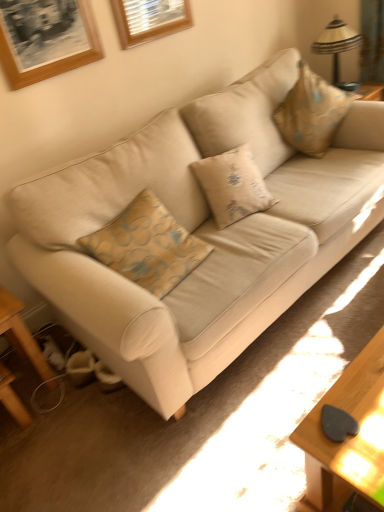
Identify the location of wooden picture frame at upper left, which ranks as the second picture frame in back-to-front order. The image size is (384, 512). (45, 38).

Where is `wooden table at lower left`? Image resolution: width=384 pixels, height=512 pixels. wooden table at lower left is located at coordinates (22, 336).

Identify the location of wooden picture frame at upper left, which is the 1th picture frame in left-to-right order. 45,38.

Is beige fabric couch at center bigger than wooden table at lower left?

Indeed, beige fabric couch at center has a larger size compared to wooden table at lower left.

Consider the image. In the image, is beige fabric couch at center positioned in front of or behind wooden table at lower left?

beige fabric couch at center is in front of wooden table at lower left.

Consider the image. Considering the positions of objects beige fabric couch at center and wooden table at lower left in the image provided, who is more to the left, beige fabric couch at center or wooden table at lower left?

Positioned to the left is wooden table at lower left.

From the picture: From the image's perspective, would you say beige fabric couch at center is shown under wooden table at lower left?

Actually, beige fabric couch at center appears above wooden table at lower left in the image.

How many degrees apart are the facing directions of wooden table at lower left and wooden picture frame at upper left, the second picture frame from the right?

There is a 0.92-degree angle between the facing directions of wooden table at lower left and wooden picture frame at upper left, the second picture frame from the right.

Considering the relative sizes of wooden table at lower left and wooden picture frame at upper left, which is the 1th picture frame in left-to-right order, in the image provided, is wooden table at lower left shorter than wooden picture frame at upper left, which is the 1th picture frame in left-to-right order,?

No.

Which object is wider, wooden table at lower left or wooden picture frame at upper left, the second picture frame from the right?

wooden table at lower left.

Is wooden table at lower left in contact with wooden picture frame at upper left, the second picture frame from the right?

No, wooden table at lower left is not beside wooden picture frame at upper left, the second picture frame from the right.

Is beige fabric pillow at upper right turned away from wooden picture frame at upper center, the second picture frame from the front?

beige fabric pillow at upper right is not turned away from wooden picture frame at upper center, the second picture frame from the front.

Which of these two, beige fabric pillow at upper right or wooden picture frame at upper center, the second picture frame from the front, is smaller?

wooden picture frame at upper center, the second picture frame from the front, is smaller.

Which is farther from the camera, (311, 86) or (136, 19)?

The point (311, 86) is more distant.

Between wooden picture frame at upper center, which is the first picture frame from back to front, and wooden picture frame at upper left, the second picture frame from the right, which one has smaller size?

With smaller size is wooden picture frame at upper center, which is the first picture frame from back to front.

Is point (122, 12) closer to camera compared to point (11, 85)?

No, it is behind (11, 85).

Based on the photo, measure the distance from wooden picture frame at upper center, the second picture frame from the front, to wooden picture frame at upper left, which ranks as the second picture frame in back-to-front order.

wooden picture frame at upper center, the second picture frame from the front, and wooden picture frame at upper left, which ranks as the second picture frame in back-to-front order, are 15.46 inches apart from each other.

Consider the image. Is wooden picture frame at upper center, which is the first picture frame from back to front, next to wooden picture frame at upper left, which is the 1th picture frame in left-to-right order, and touching it?

They are not placed beside each other.

Is beige fabric couch at center inside wooden picture frame at upper center, which is the first picture frame from back to front?

Definitely not — beige fabric couch at center is not inside wooden picture frame at upper center, which is the first picture frame from back to front.

From a real-world perspective, who is located higher, wooden picture frame at upper center, which appears as the second picture frame when viewed from the left, or beige fabric couch at center?

From a 3D spatial view, wooden picture frame at upper center, which appears as the second picture frame when viewed from the left, is above.

Image resolution: width=384 pixels, height=512 pixels. I want to click on the 2nd picture frame above the beige fabric couch at center (from the image's perspective), so pos(149,19).

Is wooden picture frame at upper center, which is the first picture frame from back to front, facing away from beige fabric couch at center?

wooden picture frame at upper center, which is the first picture frame from back to front, does not have its back to beige fabric couch at center.

From the picture: Does metallic silver table lamp at upper right have a greater height compared to wooden picture frame at upper center, which is counted as the 1th picture frame, starting from the right?

Indeed, metallic silver table lamp at upper right has a greater height compared to wooden picture frame at upper center, which is counted as the 1th picture frame, starting from the right.

Which of these two, metallic silver table lamp at upper right or wooden picture frame at upper center, the second picture frame from the front, is wider?

metallic silver table lamp at upper right.

From the image's perspective, which is above, metallic silver table lamp at upper right or wooden picture frame at upper center, the second picture frame from the front?

metallic silver table lamp at upper right, from the image's perspective.

Is beige fabric pillow at upper right located within beige fabric couch at center?

Yes, beige fabric pillow at upper right is a part of beige fabric couch at center.

Considering the sizes of beige fabric couch at center and beige fabric pillow at upper right in the image, is beige fabric couch at center taller or shorter than beige fabric pillow at upper right?

beige fabric couch at center is taller than beige fabric pillow at upper right.

Consider the image. From a real-world perspective, is beige fabric couch at center above or below beige fabric pillow at upper right?

From a real-world perspective, beige fabric couch at center is physically below beige fabric pillow at upper right.

How distant is beige fabric couch at center from beige fabric pillow at upper right?

60.78 centimeters.

Image resolution: width=384 pixels, height=512 pixels. Identify the location of studio couch lying on the right of wooden table at lower left. (200, 233).

This screenshot has width=384, height=512. I want to click on table on the left of wooden picture frame at upper left, the second picture frame from the right, so click(x=22, y=336).

Based on their spatial positions, is wooden table at lower left or beige fabric couch at center further from wooden picture frame at upper center, which is the first picture frame from back to front?

Among the two, wooden table at lower left is located further to wooden picture frame at upper center, which is the first picture frame from back to front.

Considering their positions, is wooden picture frame at upper left, which ranks as the first picture frame in front-to-back order, positioned closer to beige fabric couch at center than beige fabric pillow at upper right?

The object closer to beige fabric couch at center is beige fabric pillow at upper right.

From the image, which object appears to be nearer to wooden picture frame at upper center, which is counted as the 1th picture frame, starting from the right, beige fabric couch at center or wooden picture frame at upper left, which ranks as the first picture frame in front-to-back order?

wooden picture frame at upper left, which ranks as the first picture frame in front-to-back order.

Estimate the real-world distances between objects in this image. Which object is closer to wooden table at lower left, wooden picture frame at upper left, the second picture frame from the right, or metallic silver table lamp at upper right?

wooden picture frame at upper left, the second picture frame from the right, lies closer to wooden table at lower left than the other object.

From the image, which object appears to be nearer to wooden picture frame at upper left, which ranks as the second picture frame in back-to-front order, wooden picture frame at upper center, which is the first picture frame from back to front, or beige fabric couch at center?

The object closer to wooden picture frame at upper left, which ranks as the second picture frame in back-to-front order, is wooden picture frame at upper center, which is the first picture frame from back to front.

Considering their positions, is metallic silver table lamp at upper right positioned further to wooden picture frame at upper left, which is the 1th picture frame in left-to-right order, than wooden picture frame at upper center, which is the first picture frame from back to front?

Among the two, metallic silver table lamp at upper right is located further to wooden picture frame at upper left, which is the 1th picture frame in left-to-right order.

Considering their positions, is wooden table at lower left positioned closer to beige fabric pillow at upper right than wooden picture frame at upper center, which is the first picture frame from back to front?

wooden picture frame at upper center, which is the first picture frame from back to front.

When comparing their distances from metallic silver table lamp at upper right, does beige fabric pillow at upper right or wooden picture frame at upper left, which is the 1th picture frame in left-to-right order, seem closer?

beige fabric pillow at upper right is positioned closer to the anchor metallic silver table lamp at upper right.

Find the location of a particular element. throw pillow between wooden picture frame at upper left, which ranks as the second picture frame in back-to-front order, and metallic silver table lamp at upper right, in the horizontal direction is located at coordinates (311, 113).

Locate an element on the screen. The height and width of the screenshot is (512, 384). studio couch between wooden picture frame at upper center, which is counted as the 1th picture frame, starting from the right, and wooden table at lower left in the up-down direction is located at coordinates (200, 233).

The width and height of the screenshot is (384, 512). I want to click on throw pillow located between beige fabric couch at center and metallic silver table lamp at upper right in the depth direction, so click(x=311, y=113).

This screenshot has width=384, height=512. I want to click on throw pillow between wooden picture frame at upper center, the second picture frame from the front, and wooden table at lower left in the up-down direction, so click(x=311, y=113).